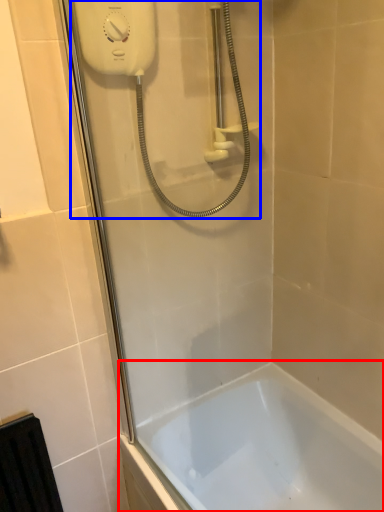
Question: Which point is closer to the camera, bathtub (highlighted by a red box) or shower (highlighted by a blue box)?

Choices:
 (A) bathtub
 (B) shower

Answer: (B)